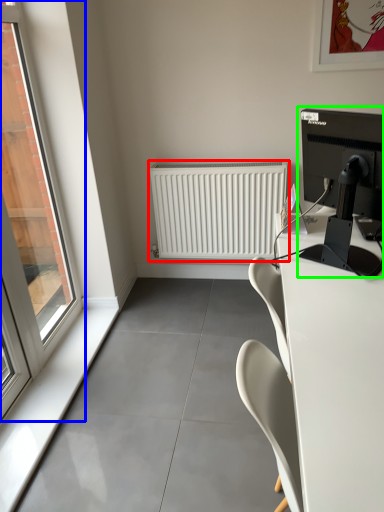
Question: Estimate the real-world distances between objects in this image. Which object is closer to radiator (highlighted by a red box), window (highlighted by a blue box) or computer monitor (highlighted by a green box)?

Choices:
 (A) window
 (B) computer monitor

Answer: (A)